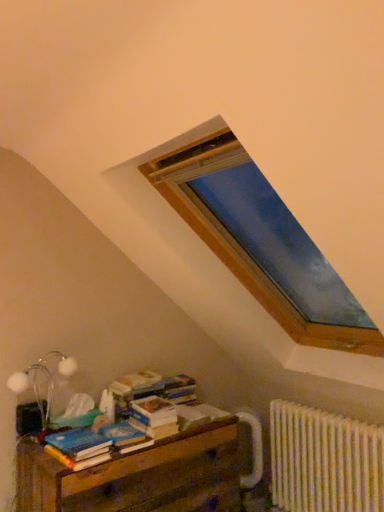
Question: Considering the positions of white matte table lamp at lower left and wooden at lower left in the image, is white matte table lamp at lower left wider or thinner than wooden at lower left?

Choices:
 (A) wide
 (B) thin

Answer: (B)

Question: In terms of height, does white matte table lamp at lower left look taller or shorter compared to wooden at lower left?

Choices:
 (A) short
 (B) tall

Answer: (A)

Question: Which object is the closest to the white paper at center, the third paperback book in the left-to-right sequence?

Choices:
 (A) blue matte paperback book at lower left, the first paperback book viewed from the left
 (B) blue matte paperback book at lower left, which ranks as the 2th paperback book in right-to-left order
 (C) white textured radiator at lower right
 (D) wooden at lower left
 (E) white matte table lamp at lower left

Answer: (D)

Question: Based on their relative distances, which object is farther from the white paper at center, placed as the first paperback book when sorted from right to left?

Choices:
 (A) blue matte paperback book at lower left, the first paperback book viewed from the left
 (B) wooden at lower left
 (C) white matte table lamp at lower left
 (D) blue matte paperback book at lower left, the second paperback book positioned from the left
 (E) white textured radiator at lower right

Answer: (C)